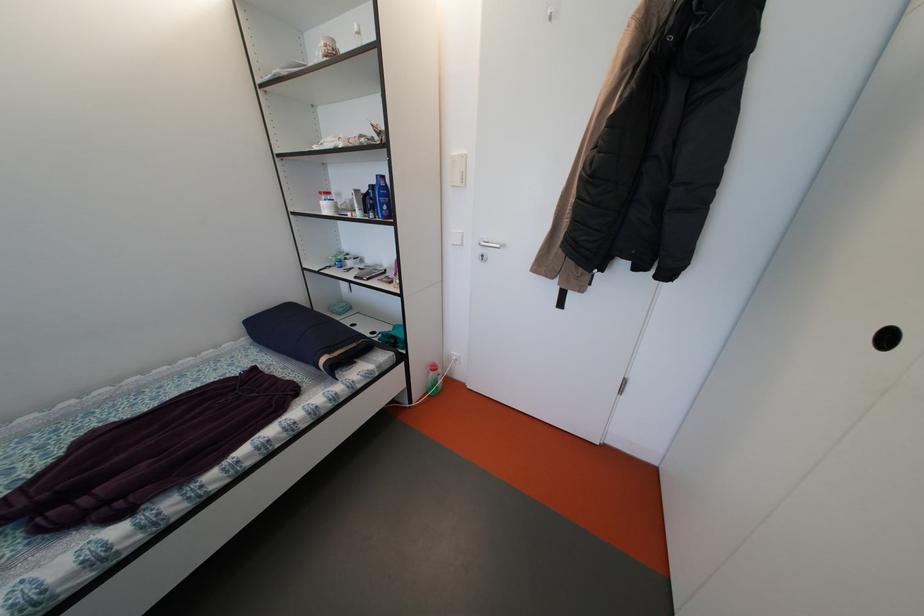
Where is `white mug`? This screenshot has width=924, height=616. white mug is located at coordinates (327, 207).